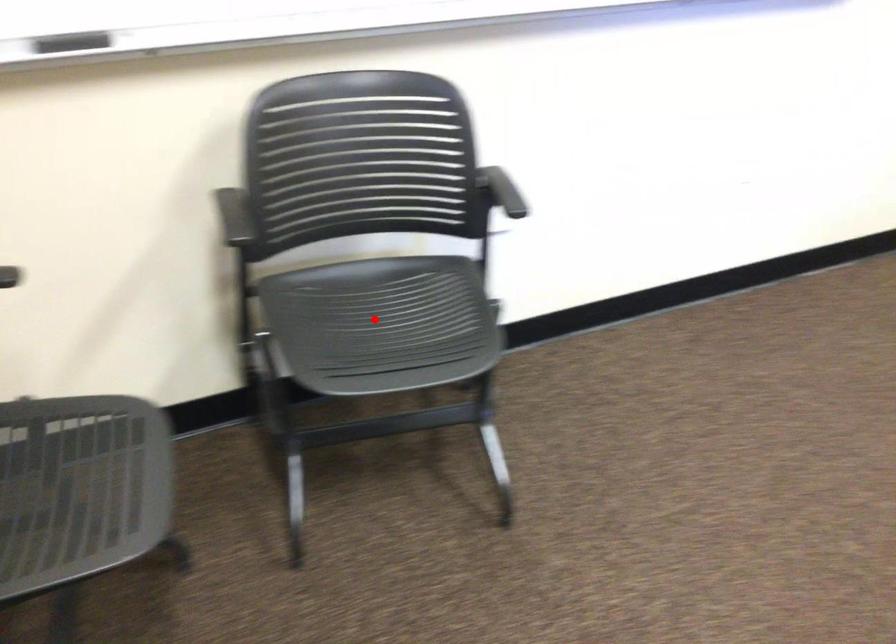
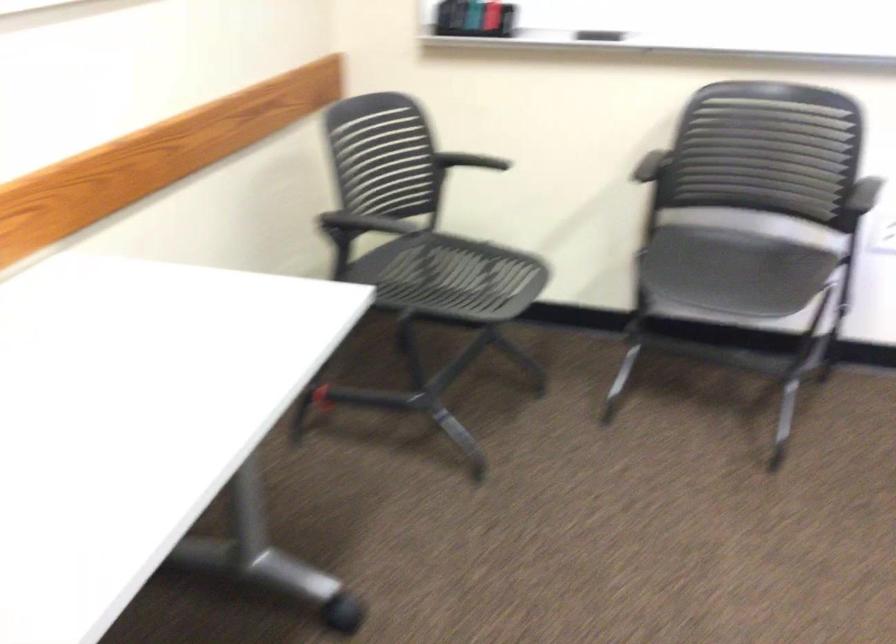
Question: I am providing you with two images of the same scene from different viewpoints. A red point is shown in image1. For the corresponding object point in image2, is it positioned nearer or farther from the camera?

Choices:
 (A) Nearer
 (B) Farther

Answer: (B)